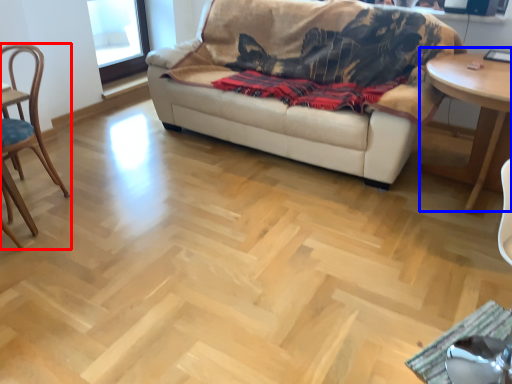
Question: Which object is further to the camera taking this photo, chair (highlighted by a red box) or table (highlighted by a blue box)?

Choices:
 (A) chair
 (B) table

Answer: (B)